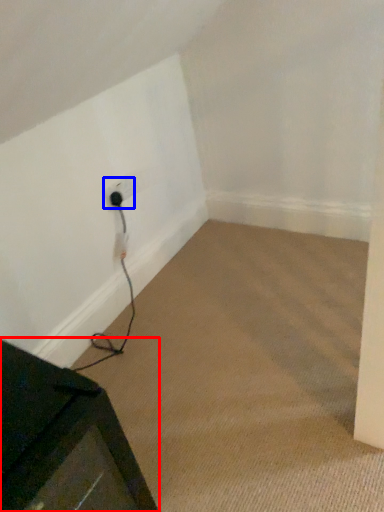
Question: Which of the following is the closest to the observer, furniture (highlighted by a red box) or electric outlet (highlighted by a blue box)?

Choices:
 (A) furniture
 (B) electric outlet

Answer: (A)